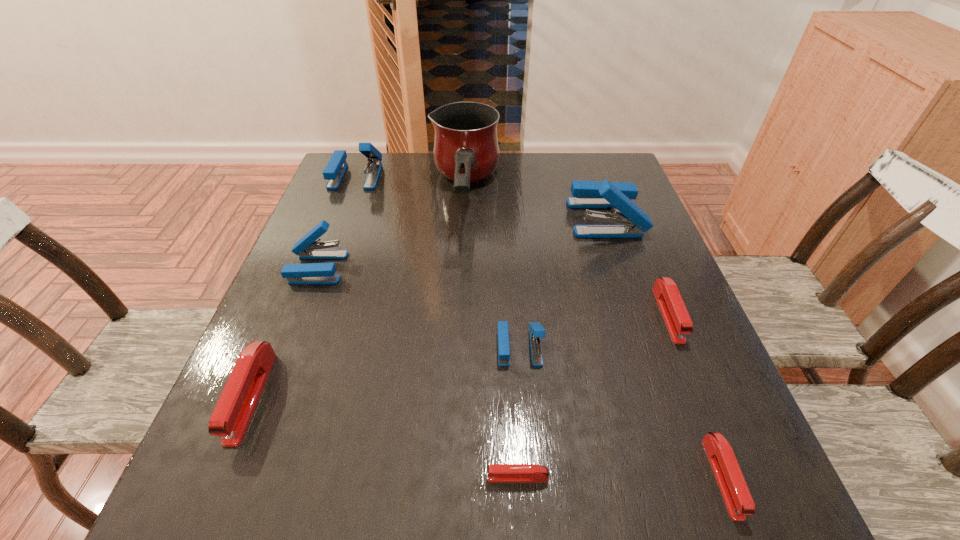
Find the location of a particular element. The width and height of the screenshot is (960, 540). blank space at the near edge of the desktop is located at coordinates (435, 483).

I want to click on vacant space at the left edge, so click(324, 352).

Image resolution: width=960 pixels, height=540 pixels. I want to click on free space at the right edge, so click(673, 424).

The height and width of the screenshot is (540, 960). In order to click on free region at the far right corner of the desktop in this screenshot , I will do `click(581, 171)`.

Where is `free spot between the third shortest stapler and the leftmost red stapler`? Image resolution: width=960 pixels, height=540 pixels. free spot between the third shortest stapler and the leftmost red stapler is located at coordinates (460, 355).

The image size is (960, 540). What are the coordinates of `empty location between the fourth tallest object and the farthest blue stapler` in the screenshot? It's located at (337, 222).

Where is `vacant region between the third biggest blue stapler and the second blue stapler from right to left`? vacant region between the third biggest blue stapler and the second blue stapler from right to left is located at coordinates (419, 307).

Identify the location of free space between the leftmost red stapler and the rightmost blue stapler. click(428, 307).

Locate an element on the screen. free space between the tallest object and the third farthest stapler is located at coordinates (391, 233).

Find the location of a particular element. Image resolution: width=960 pixels, height=540 pixels. free space between the eighth shortest object and the smallest blue stapler is located at coordinates (563, 282).